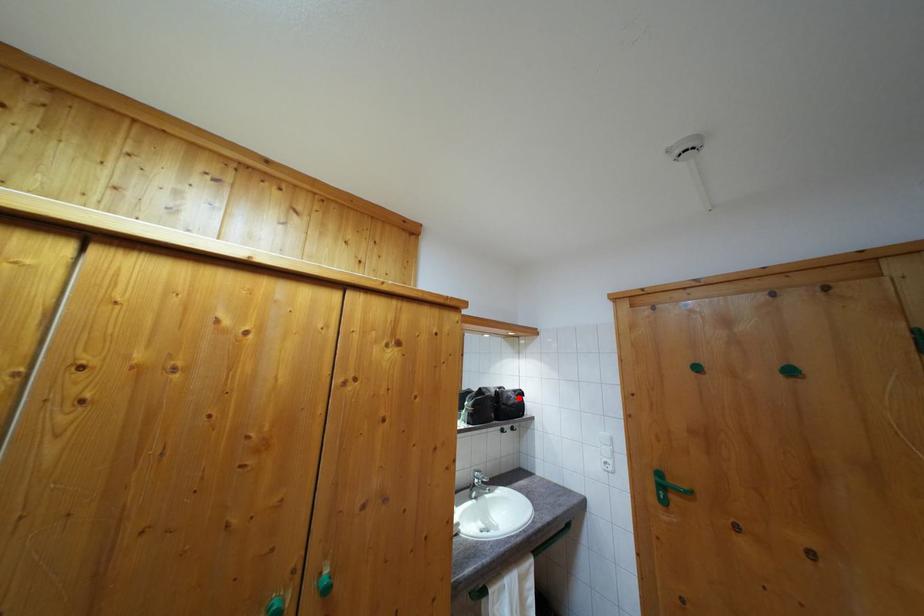
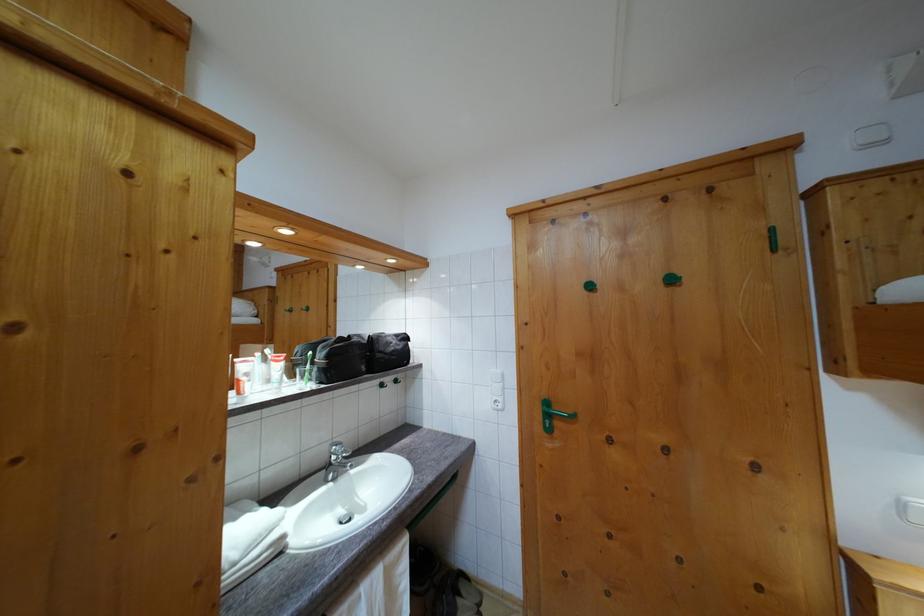
Locate, in the second image, the point that corresponds to the highlighted location in the first image.

(400, 342)